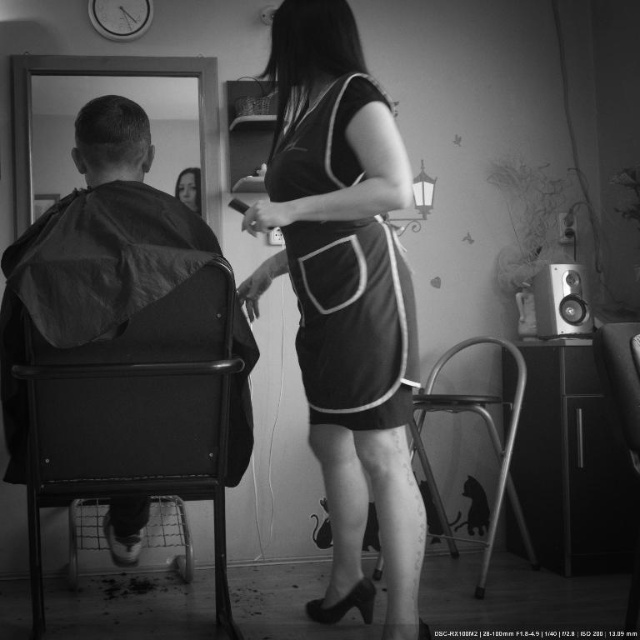
You are standing in the room and want to find the black matte dress at center. Based on the 2D coordinates provided, where should you look to locate it?

The black matte dress at center is located at the 2D coordinates point (353, 323).

You are a customer entering the haircutting setup and see the metallic black chair at left and the metallic silver chair at lower center. Which chair is closer to the entrance?

The metallic black chair at left is closer to the entrance because it is in front of the metallic silver chair at lower center, indicating it is positioned nearer to the entrance.